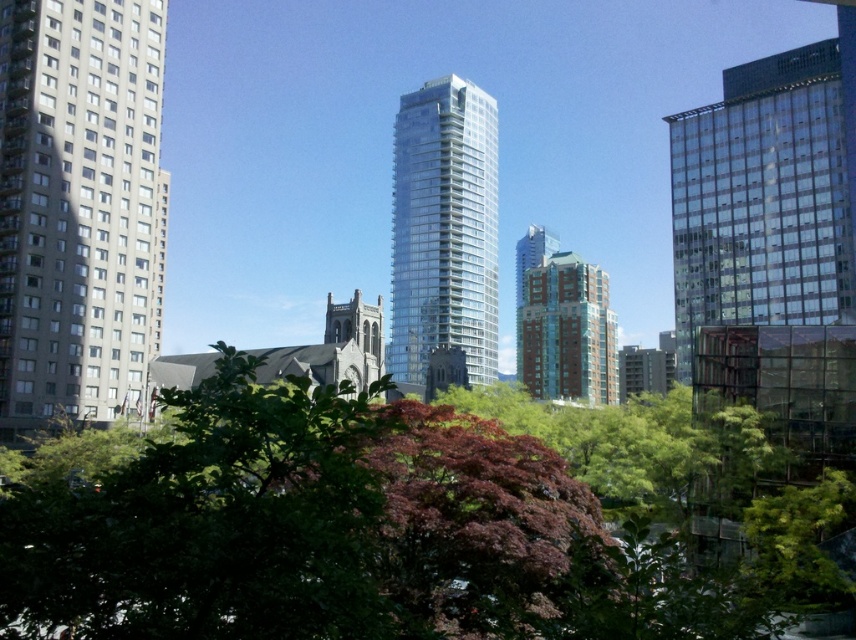
Which is more to the right, green leafy tree at center or red brick building at center?

red brick building at center

Which is more to the left, green leafy tree at center or red brick building at center?

green leafy tree at center

The height and width of the screenshot is (640, 856). What do you see at coordinates (361, 532) in the screenshot? I see `green leafy tree at center` at bounding box center [361, 532].

Find the location of a particular element. The height and width of the screenshot is (640, 856). green leafy tree at center is located at coordinates (x=361, y=532).

Between green leafy tree at center and beige concrete building at left, which one is positioned lower?

green leafy tree at center is lower down.

Between point (153, 452) and point (43, 332), which one is positioned in front?

Point (153, 452) is in front.

Is point (281, 397) behind point (137, 333)?

No, it is not.

I want to click on green leafy tree at center, so click(361, 532).

Which is in front, point (450, 324) or point (604, 272)?

Point (450, 324)

Can you confirm if clear glass tower at center is positioned to the right of red brick building at center?

Incorrect, clear glass tower at center is not on the right side of red brick building at center.

Is point (423, 280) behind point (568, 285)?

No.

Find the location of a particular element. The width and height of the screenshot is (856, 640). clear glass tower at center is located at coordinates (444, 228).